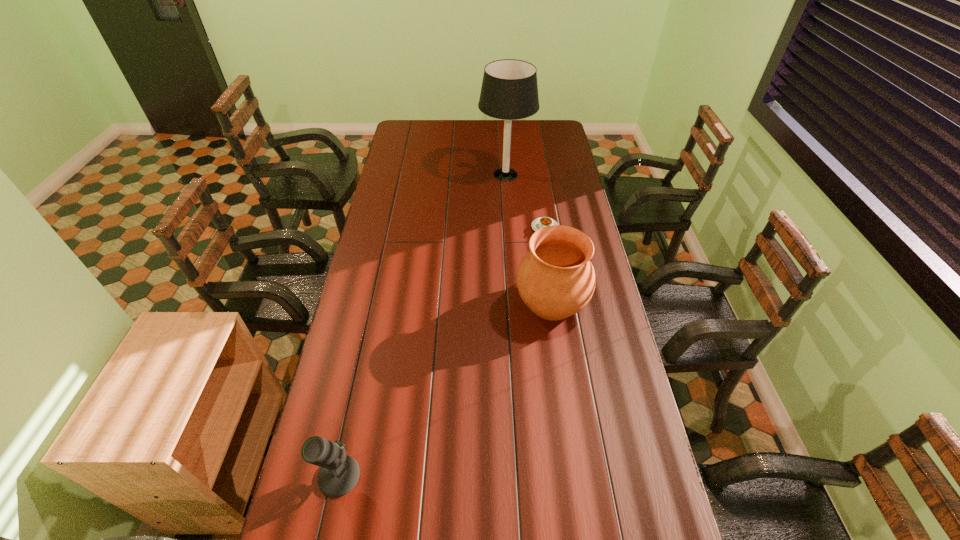
Locate an element on the screen. the tallest object is located at coordinates (509, 91).

Image resolution: width=960 pixels, height=540 pixels. In order to click on table lamp in this screenshot , I will do `click(509, 91)`.

You are a GUI agent. You are given a task and a screenshot of the screen. Output one action in this format:
    pyautogui.click(x=<x>, y=<y>)
    Task: Click on the pottery
    Image resolution: width=960 pixels, height=540 pixels.
    Given the screenshot: What is the action you would take?
    pyautogui.click(x=555, y=279)

Locate an element on the screen. The image size is (960, 540). the second nearest object is located at coordinates (555, 279).

The image size is (960, 540). What are the coordinates of `microphone` in the screenshot? It's located at (339, 474).

I want to click on the leftmost object, so click(x=339, y=474).

Find the location of a particular element. pudding is located at coordinates (541, 222).

Locate an element on the screen. The width and height of the screenshot is (960, 540). the shortest object is located at coordinates (541, 222).

Locate an element on the screen. Image resolution: width=960 pixels, height=540 pixels. vacant region located on the front of the tallest object is located at coordinates (508, 213).

Locate an element on the screen. This screenshot has width=960, height=540. vacant position located 0.080m on the back of the third shortest object is located at coordinates (545, 260).